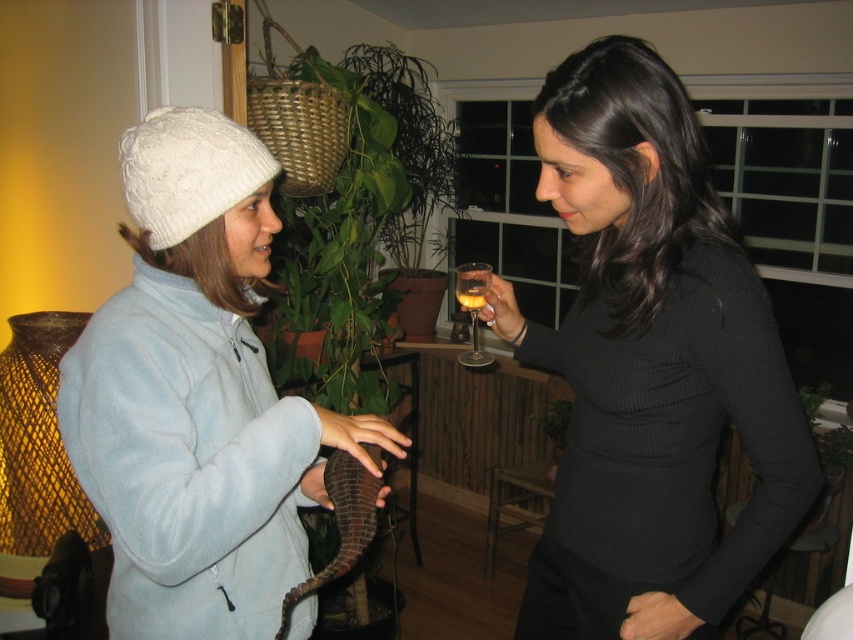
The height and width of the screenshot is (640, 853). Identify the location of white fuzzy hat at left. (196, 396).

Between point (244, 348) and point (457, 296), which one is positioned in front?

Point (244, 348)

Image resolution: width=853 pixels, height=640 pixels. I want to click on white fuzzy hat at left, so [196, 396].

Is black ribbed sweater at upper right to the left of translucent glass wine glass at center from the viewer's perspective?

Incorrect, black ribbed sweater at upper right is not on the left side of translucent glass wine glass at center.

Is point (677, 131) closer to camera compared to point (480, 266)?

Yes.

The width and height of the screenshot is (853, 640). What are the coordinates of `black ribbed sweater at upper right` in the screenshot? It's located at (650, 365).

Is black ribbed sweater at upper right bigger than white fuzzy hat at left?

Yes.

Can you confirm if black ribbed sweater at upper right is shorter than white fuzzy hat at left?

No.

Identify the location of black ribbed sweater at upper right. The width and height of the screenshot is (853, 640). (650, 365).